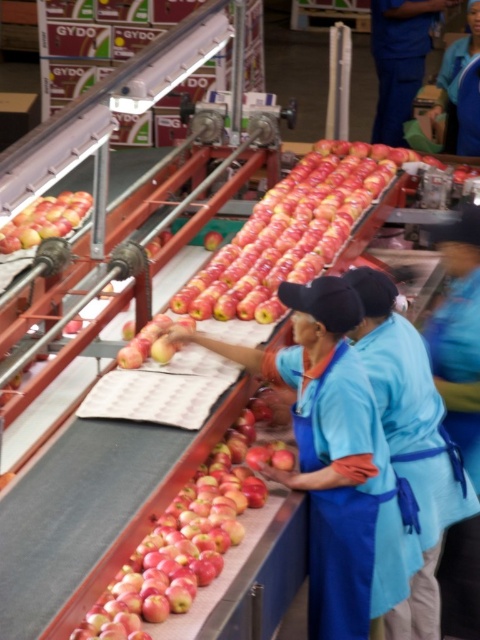
Question: Which object is farther from the camera taking this photo?

Choices:
 (A) matte blue apron at center
 (B) glossy red apple at center

Answer: (A)

Question: Is matte blue apron at center thinner than glossy red apple at center?

Choices:
 (A) no
 (B) yes

Answer: (A)

Question: Can you confirm if blue fabric apron at center is wider than glossy red apple at center?

Choices:
 (A) no
 (B) yes

Answer: (A)

Question: Which is nearer to the matte blue apron at center?

Choices:
 (A) shiny red apple at left
 (B) glossy red apple at center

Answer: (B)

Question: Among these points, which one is farthest from the camera?

Choices:
 (A) (169, 573)
 (B) (362, 502)

Answer: (B)

Question: Does matte blue apron at center have a greater width compared to blue fabric apron at center?

Choices:
 (A) yes
 (B) no

Answer: (A)